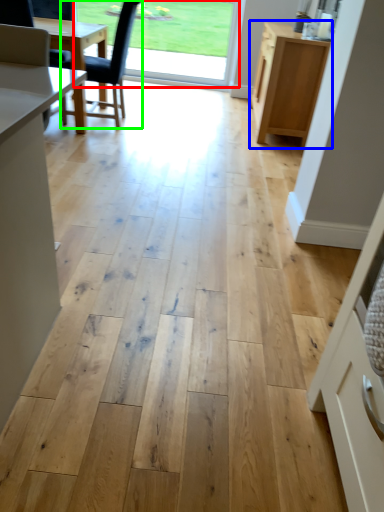
Question: Based on their relative distances, which object is farther from window screen (highlighted by a red box)? Choose from cabinetry (highlighted by a blue box) and chair (highlighted by a green box).

Choices:
 (A) cabinetry
 (B) chair

Answer: (A)